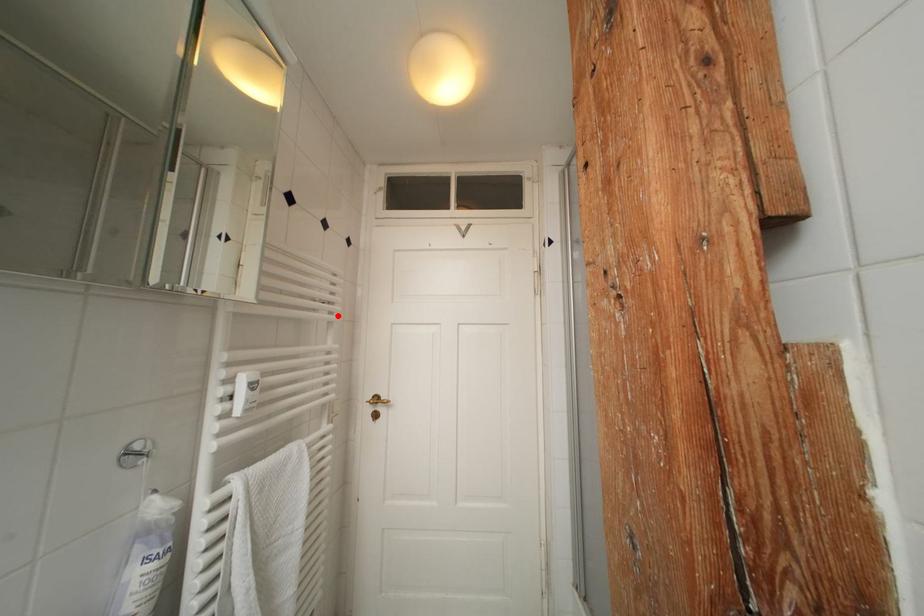
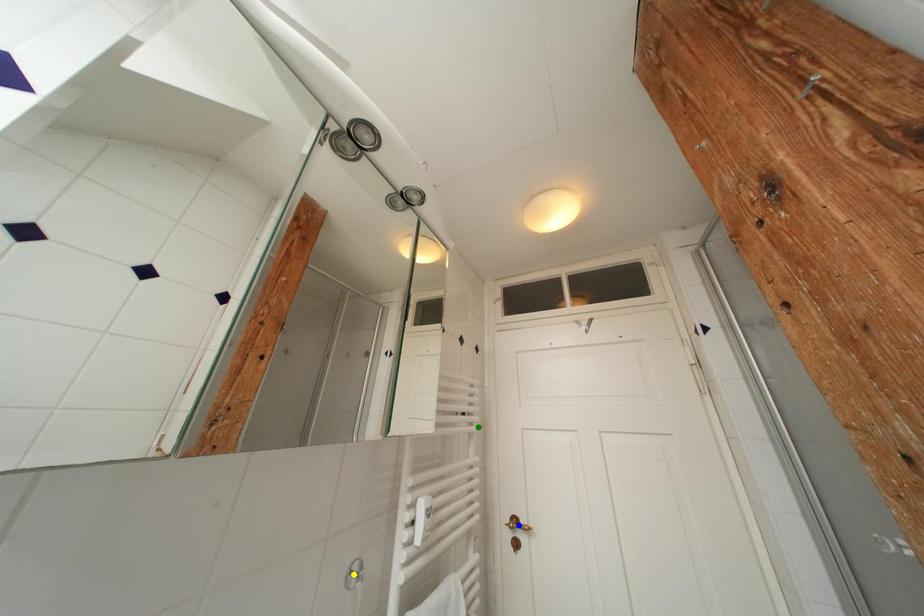
Question: I am providing you with two images of the same scene from different viewpoints. A red point is marked on the first image. You are given multiple points on the second image. Which point in image 2 is actually the same real-world point as the red point in image 1?

Choices:
 (A) yellow point
 (B) green point
 (C) blue point

Answer: (B)